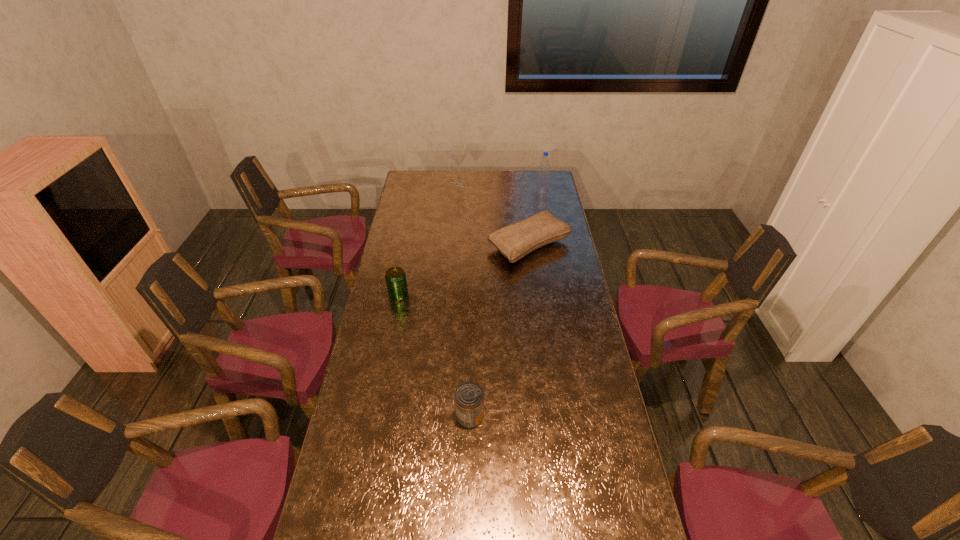
The image size is (960, 540). What are the coordinates of `vacant space at the far left corner of the desktop` in the screenshot? It's located at (415, 184).

What are the coordinates of `vacant space at the far right corner of the desktop` in the screenshot? It's located at (529, 179).

The height and width of the screenshot is (540, 960). In order to click on vacant area that lies between the can and the flute glass in this screenshot , I will do `click(465, 300)`.

The height and width of the screenshot is (540, 960). In order to click on free space between the nearest object and the fourth farthest object in this screenshot , I will do `click(434, 355)`.

Locate an element on the screen. This screenshot has height=540, width=960. vacant space that is in between the flute glass and the leftmost object is located at coordinates (429, 239).

The image size is (960, 540). I want to click on free space between the water bottle and the flute glass, so pyautogui.click(x=500, y=187).

This screenshot has height=540, width=960. In order to click on free point between the cushion and the can in this screenshot , I will do click(500, 331).

Image resolution: width=960 pixels, height=540 pixels. In order to click on free space between the can and the beer can in this screenshot , I will do `click(434, 355)`.

Where is `the second closest object to the nearest object`? The height and width of the screenshot is (540, 960). the second closest object to the nearest object is located at coordinates (515, 241).

Where is `the third closest object to the cushion`? Image resolution: width=960 pixels, height=540 pixels. the third closest object to the cushion is located at coordinates (395, 277).